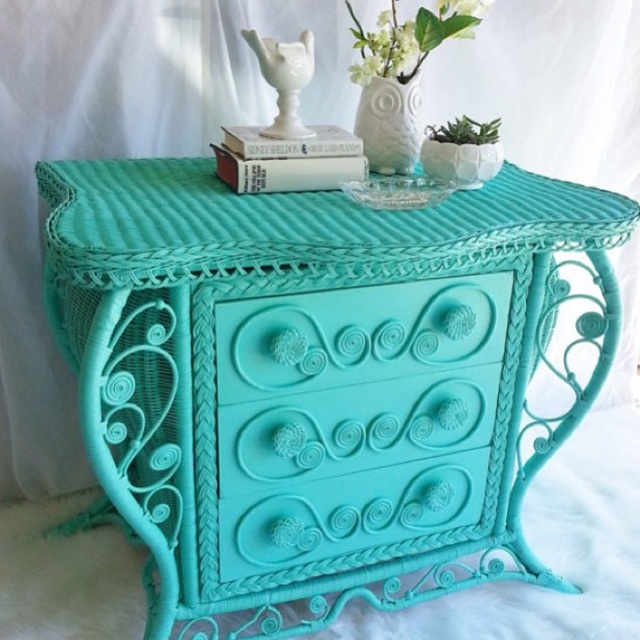
You are standing in front of the turquoise dresser and want to place a small object on the surface. You have two options for placement based on coordinates given as points. If you choose to place it at point A, which is at coordinates point (328, 333), or point B, which is at coordinates point (397, 157), which point is closer to you?

Point A, which is at coordinates point (328, 333), is closer to you because it is in front of point B, which is at coordinates point (397, 157).

You are standing in front of a turquoise wicker table at center. There is a point marked at coordinates [317,380]. Is this point located on the table?

Yes, the point [317,380] is on the turquoise wicker table at center.

You are standing in front of the image. What is the exact 2D coordinate of the turquoise wicker table at center?

The exact 2D coordinate of the turquoise wicker table at center is at point (x=317, y=380).